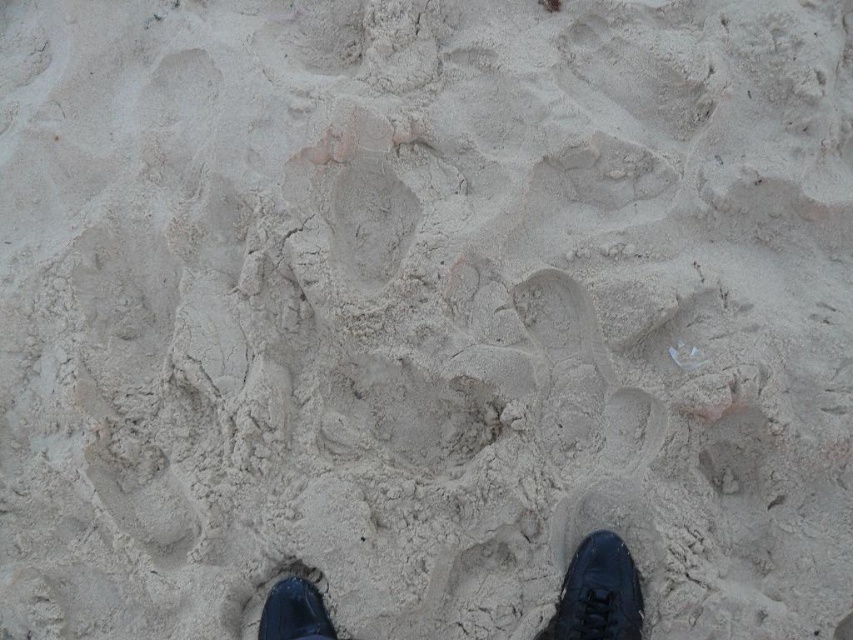
You are standing at the center of the sandy ground in the image. You want to move towards the black leather shoe at lower right. In which general direction should you walk?

The black leather shoe at lower right is located at point 0.927 on the x axis and 0.702 on the y axis. Since you are at the center, which is point 0.5 on both axes, you should walk towards the lower right direction to reach the black leather shoe at lower right.